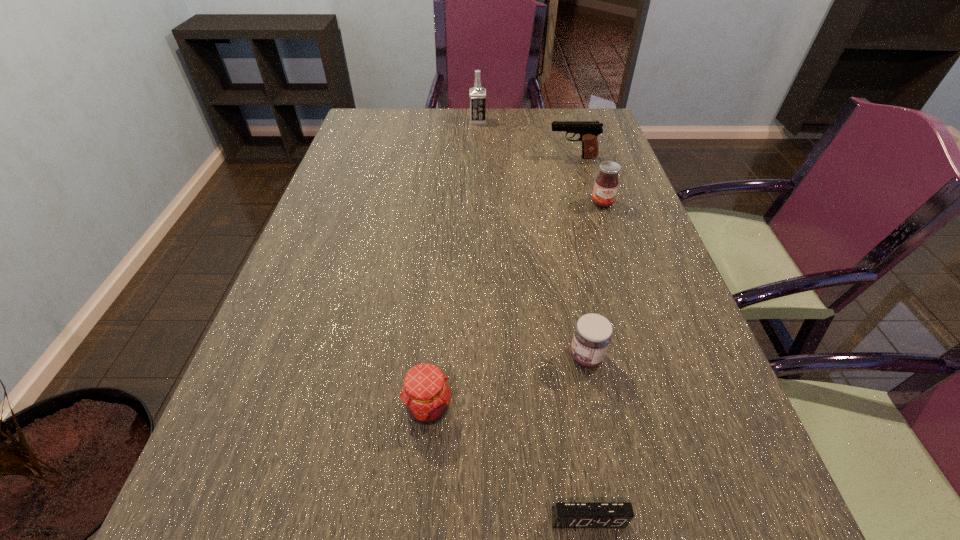
Find the location of a particular element. This screenshot has width=960, height=540. the farthest object is located at coordinates (477, 94).

This screenshot has width=960, height=540. Find the location of `the fifth object from right to left`. the fifth object from right to left is located at coordinates (477, 94).

You are a GUI agent. You are given a task and a screenshot of the screen. Output one action in this format:
    pyautogui.click(x=<x>, y=<y>)
    Task: Click on the second farthest object
    Image resolution: width=960 pixels, height=540 pixels.
    Given the screenshot: What is the action you would take?
    pyautogui.click(x=589, y=130)

Locate an element on the screen. Image resolution: width=960 pixels, height=540 pixels. the tallest jam is located at coordinates (606, 184).

This screenshot has width=960, height=540. Identify the location of the farthest jam. click(606, 184).

At what (x,y) coordinates should I click in order to perform the action: click on the second jam from right to left. Please return your answer as a coordinate pair (x, y). The width and height of the screenshot is (960, 540). Looking at the image, I should click on (592, 335).

Locate an element on the screen. the second farthest jam is located at coordinates (592, 335).

This screenshot has height=540, width=960. What are the coordinates of `the nearest jam` in the screenshot? It's located at (426, 394).

The height and width of the screenshot is (540, 960). I want to click on the leftmost object, so click(x=426, y=394).

Locate an element on the screen. Image resolution: width=960 pixels, height=540 pixels. alarm clock is located at coordinates (564, 515).